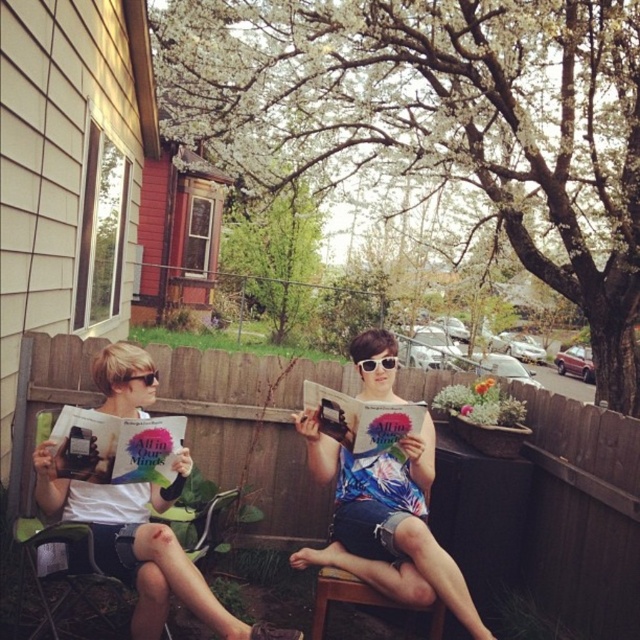
You are standing in the backyard and want to place a small potted plant between the green fabric chair at left and the black plastic sunglasses at left. Which object should the plant be closer to based on their positions?

The green fabric chair at left is closer to the viewer than the black plastic sunglasses at left, so the plant should be placed closer to the black plastic sunglasses at left to maintain the same distance from the viewer.

You are standing at the origin point in the image. Which direction should you move to reach the green fabric chair at left?

The green fabric chair at left is located at point 0.852 on the x axis and 0.212 on the y axis. Since you are at the origin point, you should move towards the positive x and positive y direction to reach it.

You are a tailor trying to decide whether to place a new accessory on the floral fabric shirt at center or the matte white book at left. Based on their widths, which object would you choose to place it on?

The floral fabric shirt at center might be wider than matte white book at left, so the accessory should be placed on the floral fabric shirt at center to ensure it fits properly.